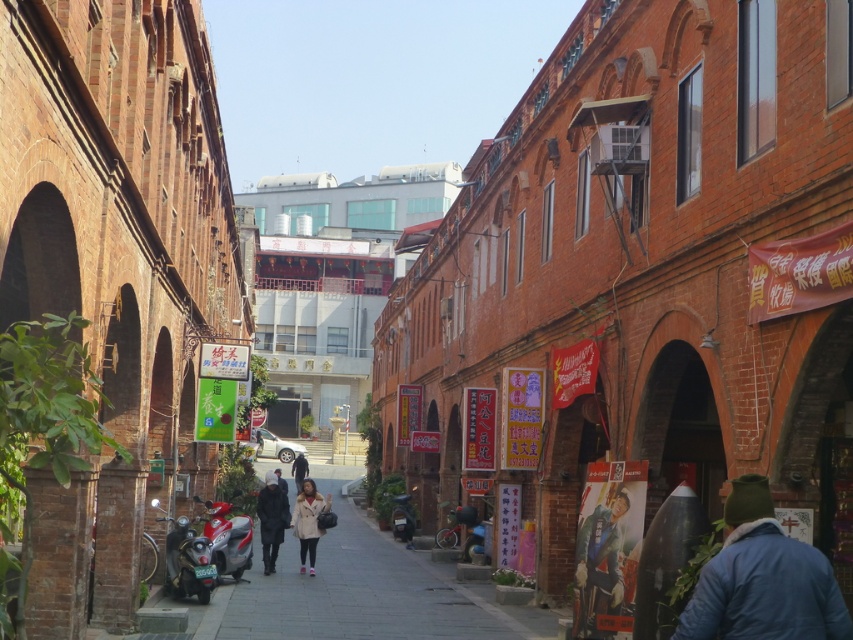
You are standing on the smooth concrete pavement at center. If you want to walk straight ahead, will you eventually reach the row of arches on the left side of the street?

No, the smooth concrete pavement at center is located at point (357, 593), which is in the middle of the street. Walking straight ahead from the center would lead you forward along the street, not towards the row of arches on the left side.